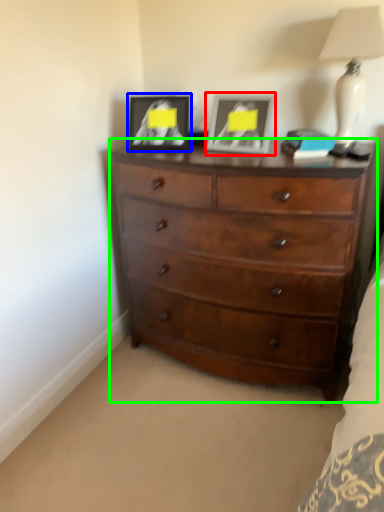
Question: Estimate the real-world distances between objects in this image. Which object is farther from picture frame (highlighted by a red box), picture frame (highlighted by a blue box) or chest of drawers (highlighted by a green box)?

Choices:
 (A) picture frame
 (B) chest of drawers

Answer: (B)